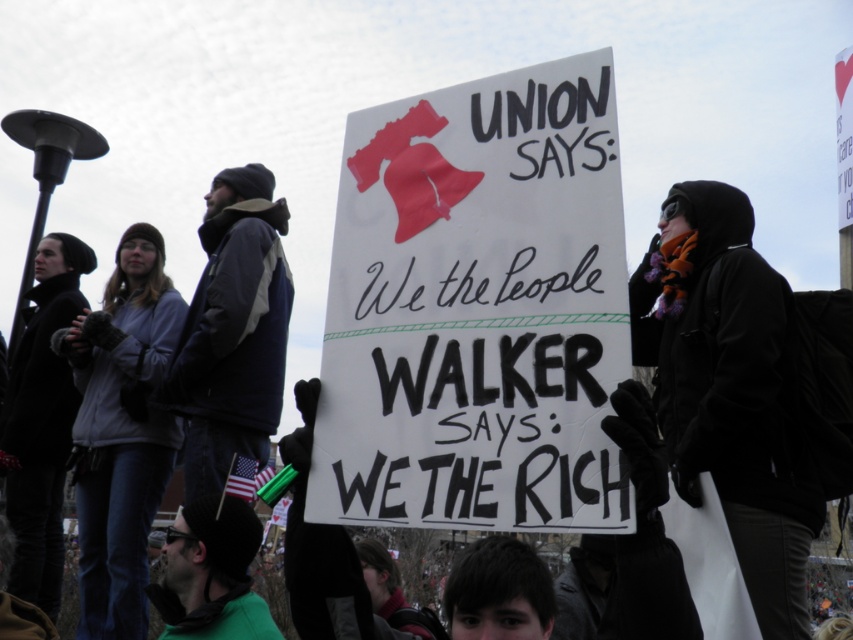
What object is located at the coordinate point (729,388)?

The black woolen scarf at right is located at the coordinate point (729,388).

Where is the black woolen scarf at right located in the image?

The black woolen scarf at right is located at point (729,388) in the image.